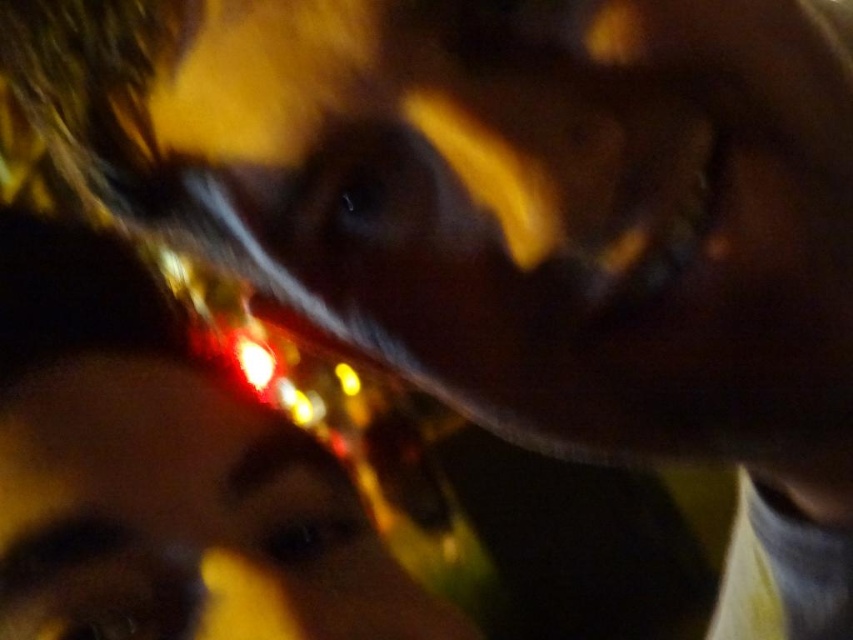
Measure the distance between glossy plastic face at center and camera.

They are 26.78 centimeters apart.

Can you confirm if glossy plastic face at center is shorter than glossy plastic face at upper center?

Incorrect, glossy plastic face at center's height does not fall short of glossy plastic face at upper center's.

I want to click on glossy plastic face at center, so click(560, 216).